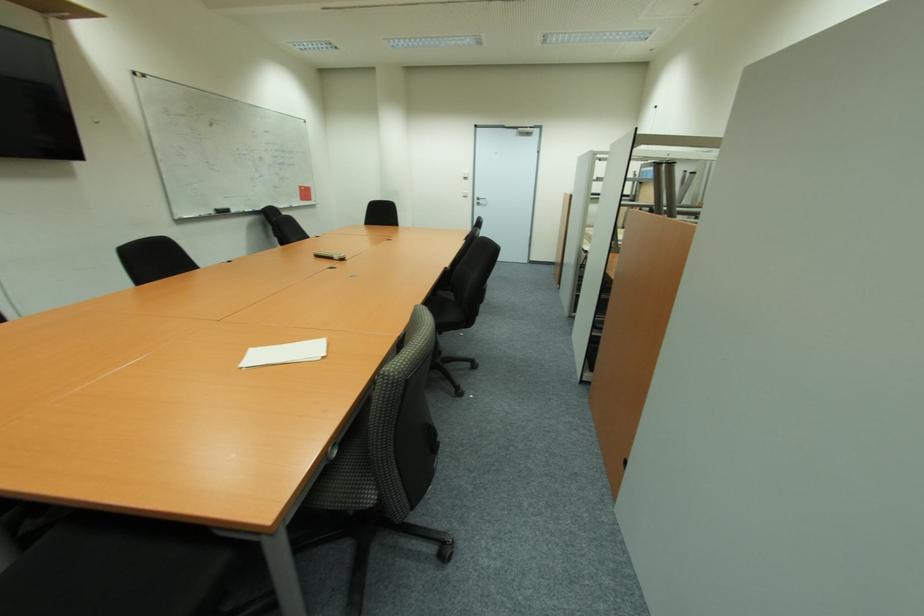
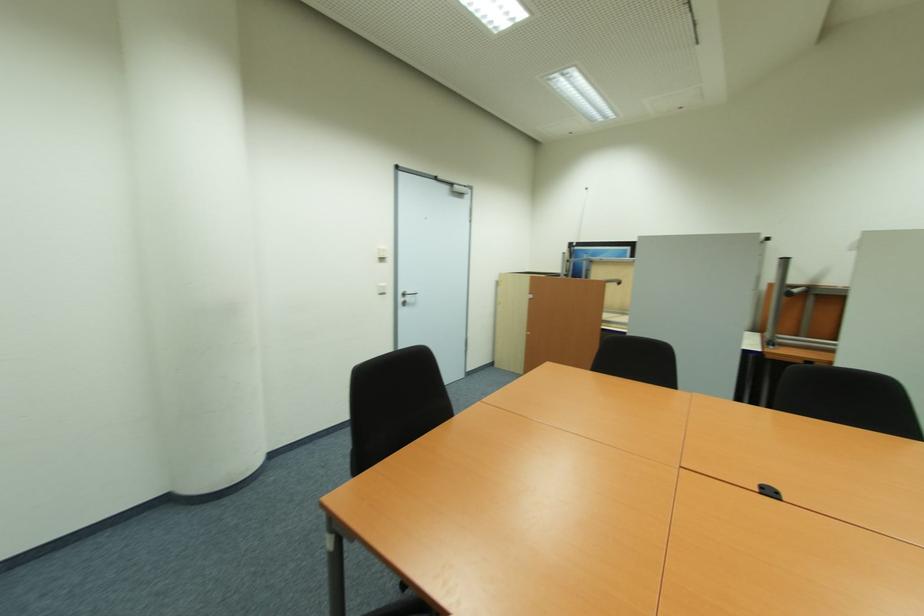
Locate, in the second image, the point that corresponds to point (468, 179) in the first image.

(385, 260)